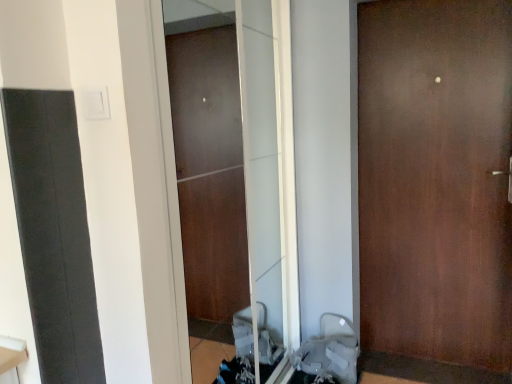
Question: Does brown matte door at center touch gray fabric baby carriage at lower right?

Choices:
 (A) yes
 (B) no

Answer: (B)

Question: Could gray fabric baby carriage at lower right be considered to be inside brown matte door at center?

Choices:
 (A) no
 (B) yes

Answer: (A)

Question: Does brown matte door at center lie behind gray fabric baby carriage at lower right?

Choices:
 (A) yes
 (B) no

Answer: (B)

Question: Is brown matte door at center positioned with its back to gray fabric baby carriage at lower right?

Choices:
 (A) yes
 (B) no

Answer: (B)

Question: Considering the relative sizes of brown matte door at center and gray fabric baby carriage at lower right in the image provided, is brown matte door at center thinner than gray fabric baby carriage at lower right?

Choices:
 (A) no
 (B) yes

Answer: (B)

Question: From a real-world perspective, does brown matte door at center sit lower than gray fabric baby carriage at lower right?

Choices:
 (A) no
 (B) yes

Answer: (A)

Question: Considering the relative sizes of brown matte door at center and transparent glass screen door at center in the image provided, is brown matte door at center thinner than transparent glass screen door at center?

Choices:
 (A) yes
 (B) no

Answer: (B)

Question: Does brown matte door at center appear on the right side of transparent glass screen door at center?

Choices:
 (A) no
 (B) yes

Answer: (B)

Question: Is brown matte door at center closer to the viewer compared to transparent glass screen door at center?

Choices:
 (A) yes
 (B) no

Answer: (B)

Question: Is brown matte door at center in contact with transparent glass screen door at center?

Choices:
 (A) yes
 (B) no

Answer: (B)

Question: Considering the relative positions of brown matte door at center and transparent glass screen door at center in the image provided, is brown matte door at center to the left of transparent glass screen door at center from the viewer's perspective?

Choices:
 (A) yes
 (B) no

Answer: (B)

Question: Are brown matte door at center and transparent glass screen door at center located far from each other?

Choices:
 (A) no
 (B) yes

Answer: (A)

Question: Are gray fabric baby carriage at lower right and brown matte door at center making contact?

Choices:
 (A) no
 (B) yes

Answer: (A)